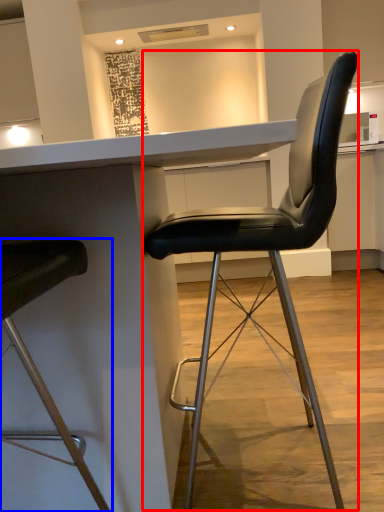
Question: Which of the following is the closest to the observer, chair (highlighted by a red box) or chair (highlighted by a blue box)?

Choices:
 (A) chair
 (B) chair

Answer: (B)